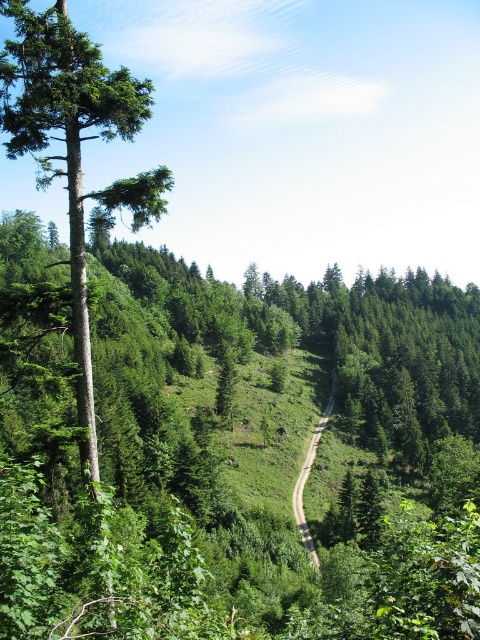
Question: Does green matte tree at left have a smaller size compared to dirt/path at center?

Choices:
 (A) no
 (B) yes

Answer: (A)

Question: Does green matte tree at left appear over dirt/path at center?

Choices:
 (A) no
 (B) yes

Answer: (B)

Question: Which object is closer to the camera taking this photo?

Choices:
 (A) dirt/path at center
 (B) green matte tree at left

Answer: (B)

Question: Does green matte tree at left come behind dirt/path at center?

Choices:
 (A) yes
 (B) no

Answer: (B)